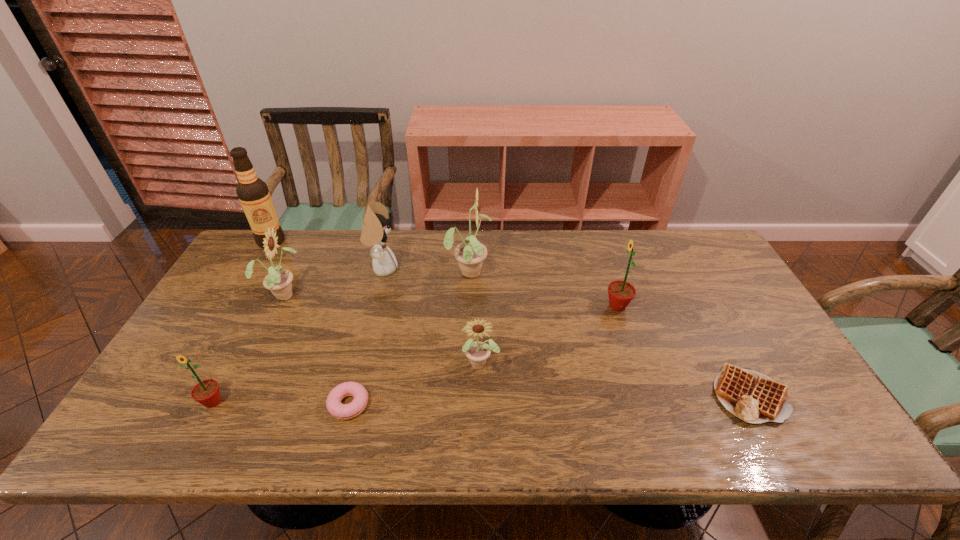
Find the location of a particular element. The height and width of the screenshot is (540, 960). object that is at the right edge is located at coordinates (753, 397).

At what (x,y) coordinates should I click in order to perform the action: click on object positioned at the far left corner. Please return your answer as a coordinate pair (x, y). The image size is (960, 540). Looking at the image, I should click on (253, 193).

Find the location of a particular element. The height and width of the screenshot is (540, 960). object that is at the near right corner is located at coordinates (753, 397).

Identify the location of vacant point at the far edge. (359, 256).

In the image, there is a desktop. Where is `vacant space at the near edge`? vacant space at the near edge is located at coordinates (422, 438).

In the image, there is a desktop. Identify the location of vacant space at the left edge. The image size is (960, 540). (202, 329).

The height and width of the screenshot is (540, 960). I want to click on blank space at the right edge of the desktop, so click(727, 326).

At what (x,y) coordinates should I click in order to perform the action: click on blank area at the far left corner. Please return your answer as a coordinate pair (x, y). Image resolution: width=960 pixels, height=540 pixels. Looking at the image, I should click on (288, 234).

Find the location of a particular element. This screenshot has height=540, width=960. empty space between the biggest yellow sunflower and the leftmost yellow sunflower is located at coordinates (376, 282).

Find the location of a particular element. The image size is (960, 540). empty space that is in between the right green sunflower and the beige alcohol is located at coordinates (444, 274).